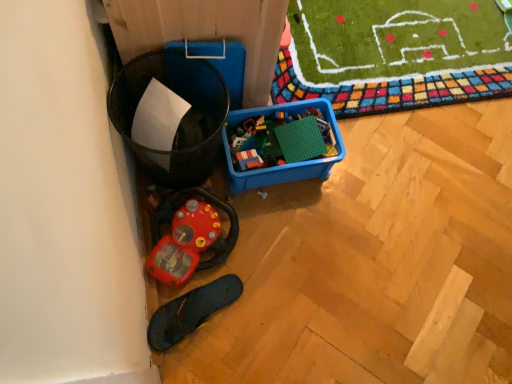
Question: Are rubberized plastic toy at lower left, placed as the 1th toy when sorted from bottom to top, and green matte building blocks at center, acting as the 1th toy starting from the right, making contact?

Choices:
 (A) no
 (B) yes

Answer: (A)

Question: Is rubberized plastic toy at lower left, placed as the 1th toy when sorted from bottom to top, taller than green matte building blocks at center, which ranks as the 2th toy in bottom-to-top order?

Choices:
 (A) no
 (B) yes

Answer: (B)

Question: From a real-world perspective, is rubberized plastic toy at lower left, placed as the 1th toy when sorted from bottom to top, over green matte building blocks at center, acting as the 1th toy starting from the right?

Choices:
 (A) no
 (B) yes

Answer: (A)

Question: From the image's perspective, is rubberized plastic toy at lower left, placed as the 1th toy when sorted from bottom to top, under green matte building blocks at center, which is the first toy in top-to-bottom order?

Choices:
 (A) no
 (B) yes

Answer: (B)

Question: Is rubberized plastic toy at lower left, which is the 2th toy from right to left, closer to the viewer compared to green matte building blocks at center, which ranks as the 2th toy in bottom-to-top order?

Choices:
 (A) yes
 (B) no

Answer: (A)

Question: From a real-world perspective, is rubberized plastic toy at lower left, arranged as the 1th toy when viewed from the left, positioned above or below black rubber slipper at lower left?

Choices:
 (A) above
 (B) below

Answer: (A)

Question: Is rubberized plastic toy at lower left, which ranks as the second toy in top-to-bottom order, inside the boundaries of black rubber slipper at lower left, or outside?

Choices:
 (A) inside
 (B) outside

Answer: (B)

Question: Is rubberized plastic toy at lower left, which ranks as the second toy in top-to-bottom order, to the left or to the right of black rubber slipper at lower left in the image?

Choices:
 (A) left
 (B) right

Answer: (A)

Question: From their relative heights in the image, would you say rubberized plastic toy at lower left, which ranks as the second toy in top-to-bottom order, is taller or shorter than black rubber slipper at lower left?

Choices:
 (A) tall
 (B) short

Answer: (A)

Question: From a real-world perspective, is black rubber slipper at lower left positioned above or below rubberized plastic toy at lower left, which is the 2th toy from right to left?

Choices:
 (A) below
 (B) above

Answer: (A)

Question: In the image, is black rubber slipper at lower left on the left side or the right side of rubberized plastic toy at lower left, which ranks as the second toy in top-to-bottom order?

Choices:
 (A) left
 (B) right

Answer: (B)

Question: In terms of height, does black rubber slipper at lower left look taller or shorter compared to rubberized plastic toy at lower left, placed as the 1th toy when sorted from bottom to top?

Choices:
 (A) tall
 (B) short

Answer: (B)

Question: In terms of width, does black rubber slipper at lower left look wider or thinner when compared to rubberized plastic toy at lower left, which is the 2th toy from right to left?

Choices:
 (A) thin
 (B) wide

Answer: (B)

Question: From the image's perspective, relative to green matte building blocks at center, acting as the 1th toy starting from the right, is black rubber slipper at lower left above or below?

Choices:
 (A) below
 (B) above

Answer: (A)

Question: Considering the positions of point (236, 297) and point (337, 153), is point (236, 297) closer or farther from the camera than point (337, 153)?

Choices:
 (A) closer
 (B) farther

Answer: (A)